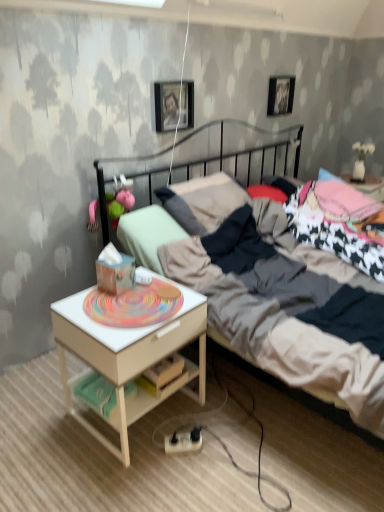
The image size is (384, 512). What are the coordinates of `dark gray metal bed at center` in the screenshot? It's located at (268, 295).

What is the approximate width of metallic photo frame at upper center, acting as the first picture frame starting from the front?

metallic photo frame at upper center, acting as the first picture frame starting from the front, is 2.41 inches wide.

What are the coordinates of `metallic silver picture frame at upper center, arranged as the first picture frame when viewed from the right` in the screenshot? It's located at (280, 95).

Between white wood nightstand at lower left and metallic silver picture frame at upper center, marked as the 2th picture frame in a bottom-to-top arrangement, which one has larger width?

With larger width is white wood nightstand at lower left.

Considering the relative sizes of white wood nightstand at lower left and metallic silver picture frame at upper center, which is the second picture frame in left-to-right order, in the image provided, is white wood nightstand at lower left smaller than metallic silver picture frame at upper center, which is the second picture frame in left-to-right order,?

No, white wood nightstand at lower left is not smaller than metallic silver picture frame at upper center, which is the second picture frame in left-to-right order.

In the image, there is a metallic silver picture frame at upper center, which appears as the first picture frame when viewed from the back. Identify the location of nightstand below it (from the image's perspective). (130, 344).

Which is behind, point (311, 362) or point (116, 222)?

The point (116, 222) is more distant.

Is dark gray metal bed at center looking in the opposite direction of pink fabric toy at left?

Yes, dark gray metal bed at center is facing away from pink fabric toy at left.

Which object is further away from the camera taking this photo, dark gray metal bed at center or pink fabric toy at left?

pink fabric toy at left is further from the camera.

Considering the sizes of metallic photo frame at upper center, which is the 2th picture frame from back to front, and metallic silver picture frame at upper center, which is the second picture frame in left-to-right order, in the image, is metallic photo frame at upper center, which is the 2th picture frame from back to front, taller or shorter than metallic silver picture frame at upper center, which is the second picture frame in left-to-right order,?

Clearly, metallic photo frame at upper center, which is the 2th picture frame from back to front, is shorter compared to metallic silver picture frame at upper center, which is the second picture frame in left-to-right order.

From the picture: Between metallic photo frame at upper center, arranged as the second picture frame when viewed from the top, and metallic silver picture frame at upper center, arranged as the first picture frame when viewed from the right, which one has larger size?

metallic photo frame at upper center, arranged as the second picture frame when viewed from the top, is bigger.

Which of these two, metallic photo frame at upper center, the first picture frame from the left, or metallic silver picture frame at upper center, the 1th picture frame from the top, is wider?

metallic photo frame at upper center, the first picture frame from the left.

Is the surface of metallic photo frame at upper center, which is the 2th picture frame from back to front, in direct contact with white wood nightstand at lower left?

No, metallic photo frame at upper center, which is the 2th picture frame from back to front, is not in contact with white wood nightstand at lower left.

Considering the points (163, 82) and (167, 312), which point is in front, point (163, 82) or point (167, 312)?

The point (167, 312) is closer.

Can you confirm if metallic photo frame at upper center, which is counted as the second picture frame, starting from the right, is bigger than white wood nightstand at lower left?

Actually, metallic photo frame at upper center, which is counted as the second picture frame, starting from the right, might be smaller than white wood nightstand at lower left.

How different are the orientations of metallic photo frame at upper center, which is the 2th picture frame from back to front, and white wood nightstand at lower left in degrees?

The angular difference between metallic photo frame at upper center, which is the 2th picture frame from back to front, and white wood nightstand at lower left is 0.051 degrees.

Considering the relative positions of pink fabric toy at left and dark gray metal bed at center in the image provided, is pink fabric toy at left to the left of dark gray metal bed at center from the viewer's perspective?

Yes, pink fabric toy at left is to the left of dark gray metal bed at center.

Considering the positions of point (123, 212) and point (254, 301), is point (123, 212) closer or farther from the camera than point (254, 301)?

Clearly, point (123, 212) is more distant from the camera than point (254, 301).

From their relative heights in the image, would you say pink fabric toy at left is taller or shorter than dark gray metal bed at center?

Clearly, pink fabric toy at left is shorter compared to dark gray metal bed at center.

Can we say pink fabric toy at left lies outside dark gray metal bed at center?

Actually, pink fabric toy at left is at least partially inside dark gray metal bed at center.

Does point (293, 98) lie in front of point (149, 407)?

That is False.

Considering the sizes of metallic silver picture frame at upper center, the 1th picture frame from the top, and white wood nightstand at lower left in the image, is metallic silver picture frame at upper center, the 1th picture frame from the top, bigger or smaller than white wood nightstand at lower left?

metallic silver picture frame at upper center, the 1th picture frame from the top, is smaller than white wood nightstand at lower left.

Consider the image. What's the angular difference between pink fabric toy at left and metallic photo frame at upper center, which is counted as the second picture frame, starting from the right,'s facing directions?

The facing directions of pink fabric toy at left and metallic photo frame at upper center, which is counted as the second picture frame, starting from the right, are 5.26 degrees apart.

Are pink fabric toy at left and metallic photo frame at upper center, the first picture frame in the bottom-to-top sequence, far apart?

No, pink fabric toy at left is in close proximity to metallic photo frame at upper center, the first picture frame in the bottom-to-top sequence.

At what (x,y) coordinates should I click in order to perform the action: click on the 1st picture frame to the right of the pink fabric toy at left, counting from the anchor's position. Please return your answer as a coordinate pair (x, y). The height and width of the screenshot is (512, 384). Looking at the image, I should click on (173, 105).

Considering the sizes of objects pink fabric toy at left and metallic photo frame at upper center, which is the 2th picture frame from back to front, in the image provided, who is smaller, pink fabric toy at left or metallic photo frame at upper center, which is the 2th picture frame from back to front,?

Smaller between the two is metallic photo frame at upper center, which is the 2th picture frame from back to front.

The height and width of the screenshot is (512, 384). Find the location of `nightstand that is below the metallic silver picture frame at upper center, marked as the 2th picture frame in a bottom-to-top arrangement (from the image's perspective)`. nightstand that is below the metallic silver picture frame at upper center, marked as the 2th picture frame in a bottom-to-top arrangement (from the image's perspective) is located at coordinates point(130,344).

The width and height of the screenshot is (384, 512). In order to click on toy on the left side of dark gray metal bed at center in this screenshot , I will do `click(119, 203)`.

When comparing their distances from metallic silver picture frame at upper center, which is the 2th picture frame in front-to-back order, does dark gray metal bed at center or pink fabric toy at left seem closer?

Based on the image, dark gray metal bed at center appears to be nearer to metallic silver picture frame at upper center, which is the 2th picture frame in front-to-back order.

Which object lies further to the anchor point pink fabric toy at left, metallic silver picture frame at upper center, which appears as the first picture frame when viewed from the back, or dark gray metal bed at center?

Based on the image, metallic silver picture frame at upper center, which appears as the first picture frame when viewed from the back, appears to be further to pink fabric toy at left.

From the image, which object appears to be nearer to metallic photo frame at upper center, the first picture frame in the bottom-to-top sequence, dark gray metal bed at center or metallic silver picture frame at upper center, the 1th picture frame from the top?

dark gray metal bed at center lies closer to metallic photo frame at upper center, the first picture frame in the bottom-to-top sequence, than the other object.

Estimate the real-world distances between objects in this image. Which object is further from metallic silver picture frame at upper center, which is the second picture frame in left-to-right order, metallic photo frame at upper center, which is counted as the second picture frame, starting from the right, or dark gray metal bed at center?

dark gray metal bed at center lies further to metallic silver picture frame at upper center, which is the second picture frame in left-to-right order, than the other object.

From the image, which object appears to be farther from metallic silver picture frame at upper center, which is the 2th picture frame in front-to-back order, pink fabric toy at left or white wood nightstand at lower left?

The object further to metallic silver picture frame at upper center, which is the 2th picture frame in front-to-back order, is white wood nightstand at lower left.

When comparing their distances from dark gray metal bed at center, does metallic photo frame at upper center, acting as the first picture frame starting from the front, or white wood nightstand at lower left seem closer?

white wood nightstand at lower left lies closer to dark gray metal bed at center than the other object.

Estimate the real-world distances between objects in this image. Which object is further from metallic photo frame at upper center, the first picture frame from the left, pink fabric toy at left or white wood nightstand at lower left?

Among the two, white wood nightstand at lower left is located further to metallic photo frame at upper center, the first picture frame from the left.

Looking at the image, which one is located further to metallic silver picture frame at upper center, the 1th picture frame from the top, pink fabric toy at left or metallic photo frame at upper center, acting as the first picture frame starting from the front?

pink fabric toy at left is positioned further to the anchor metallic silver picture frame at upper center, the 1th picture frame from the top.

Where is `nightstand between dark gray metal bed at center and metallic silver picture frame at upper center, arranged as the first picture frame when viewed from the right, along the z-axis`? This screenshot has width=384, height=512. nightstand between dark gray metal bed at center and metallic silver picture frame at upper center, arranged as the first picture frame when viewed from the right, along the z-axis is located at coordinates (130, 344).

Locate an element on the screen. The width and height of the screenshot is (384, 512). toy between metallic silver picture frame at upper center, the 1th picture frame from the top, and white wood nightstand at lower left from top to bottom is located at coordinates (119, 203).

Identify the location of picture frame between dark gray metal bed at center and metallic silver picture frame at upper center, which is the second picture frame in left-to-right order, from front to back. [173, 105].

At what (x,y) coordinates should I click in order to perform the action: click on picture frame between metallic silver picture frame at upper center, arranged as the first picture frame when viewed from the right, and white wood nightstand at lower left, in the vertical direction. Please return your answer as a coordinate pair (x, y). The height and width of the screenshot is (512, 384). Looking at the image, I should click on (173, 105).